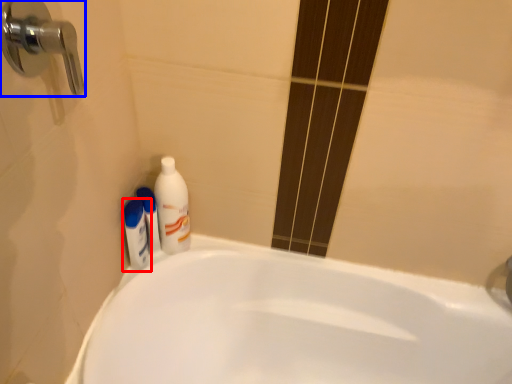
Question: Which object is further to the camera taking this photo, mouthwash (highlighted by a red box) or door handle (highlighted by a blue box)?

Choices:
 (A) mouthwash
 (B) door handle

Answer: (A)